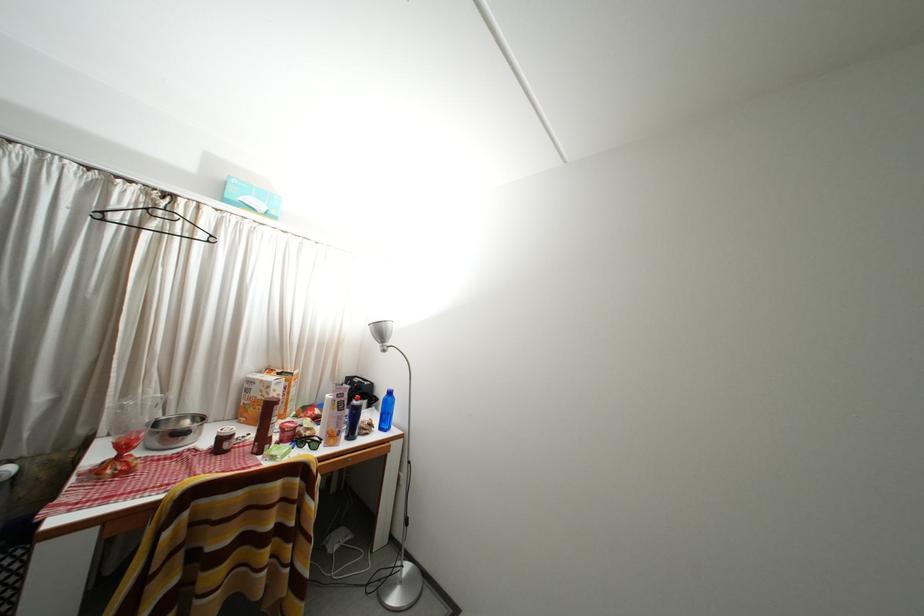
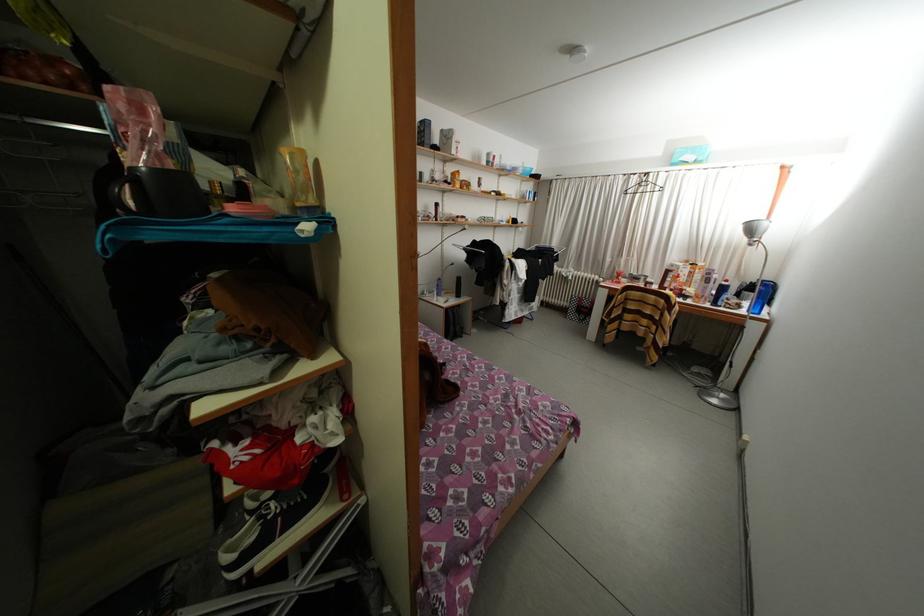
Where in the second image is the point corresponding to (x=379, y=431) from the first image?

(747, 310)